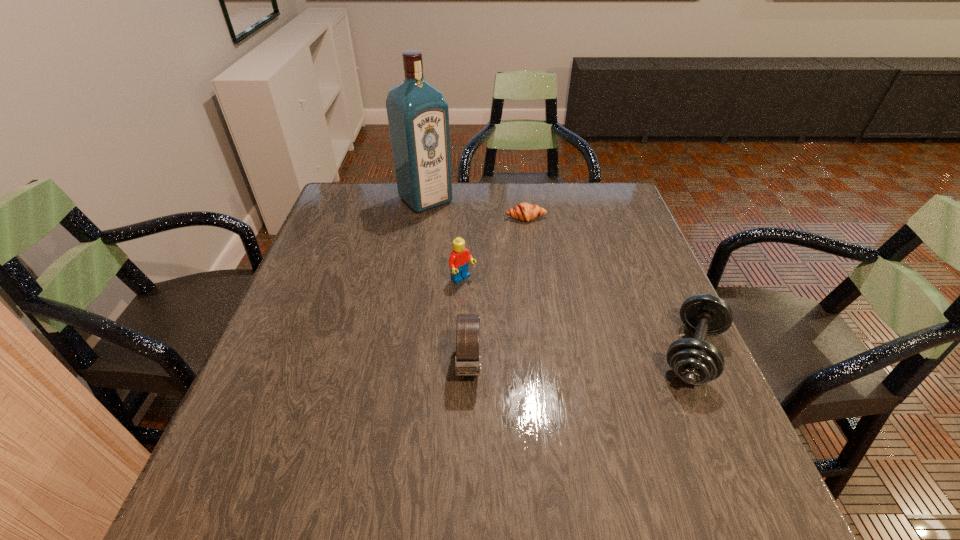
The width and height of the screenshot is (960, 540). I want to click on free spot on the desktop that is between the watch and the fourth tallest object and is positioned on the front-facing side of the pastry, so click(568, 359).

Locate an element on the screen. This screenshot has width=960, height=540. free space on the desktop that is between the watch and the dumbbell and is positioned on the flat label side of the tallest object is located at coordinates (597, 357).

The width and height of the screenshot is (960, 540). I want to click on vacant spot on the desktop that is between the watch and the rightmost object and is positioned on the face of the third farthest object, so click(563, 359).